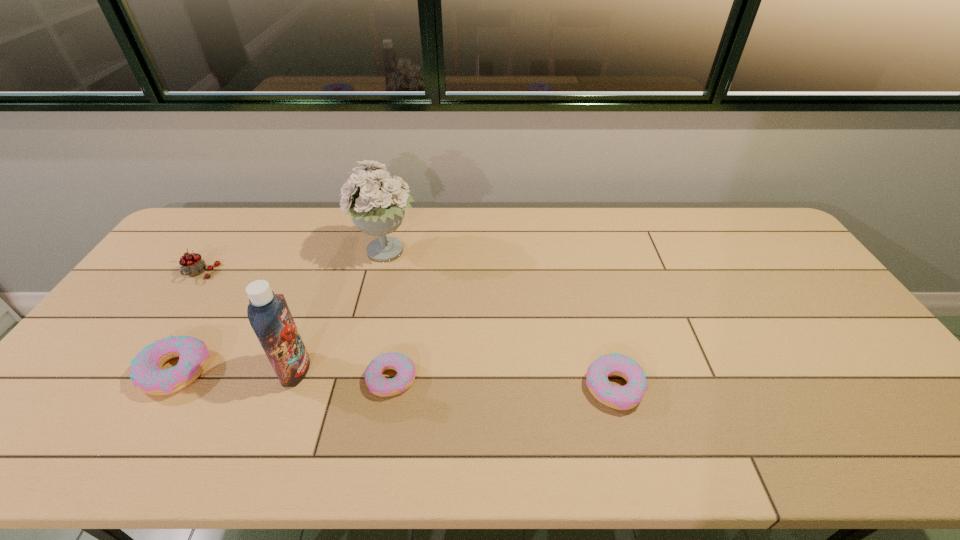
This screenshot has height=540, width=960. In order to click on free space located on the right of the shortest doughnut in this screenshot , I will do `click(507, 379)`.

The image size is (960, 540). I want to click on free point located on the right of the rightmost doughnut, so click(802, 387).

Where is `vacant space located on the right of the bouquet`? The image size is (960, 540). vacant space located on the right of the bouquet is located at coordinates (528, 253).

Image resolution: width=960 pixels, height=540 pixels. Find the location of `vacant point located 0.350m on the handle side of the cherry`. vacant point located 0.350m on the handle side of the cherry is located at coordinates (128, 380).

I want to click on blank area located on the front label of the shampoo, so click(x=453, y=370).

Where is `object that is at the far edge`? Image resolution: width=960 pixels, height=540 pixels. object that is at the far edge is located at coordinates (377, 206).

This screenshot has height=540, width=960. Identify the location of shampoo that is at the near edge. (268, 313).

The image size is (960, 540). Find the location of `object that is at the left edge`. object that is at the left edge is located at coordinates (192, 264).

In the image, there is a desktop. Where is `free space at the far edge`? This screenshot has width=960, height=540. free space at the far edge is located at coordinates (293, 240).

The height and width of the screenshot is (540, 960). I want to click on vacant space at the near edge, so point(495,397).